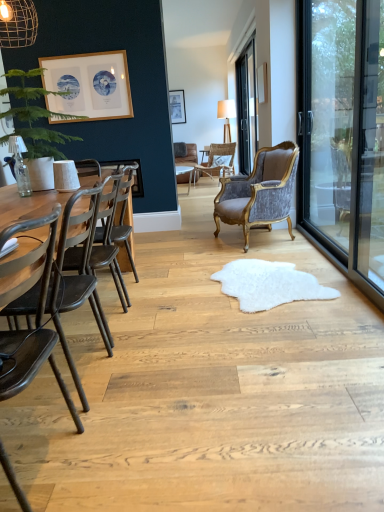
The height and width of the screenshot is (512, 384). I want to click on dark brown wood chair at left, which ranks as the 3th chair in back-to-front order, so click(108, 244).

Describe the element at coordinates (34, 117) in the screenshot. I see `green matte plant at left` at that location.

In order to face green matte plant at left, should I rotate leftwards or rightwards?

To align with it, rotate left about 20.318°.

Locate an element on the screen. The width and height of the screenshot is (384, 512). wooden picture frame at upper right, which is the first picture frame from right to left is located at coordinates (262, 83).

This screenshot has width=384, height=512. What do you see at coordinates (89, 85) in the screenshot?
I see `wooden framed artwork at upper left, which ranks as the third picture frame in right-to-left order` at bounding box center [89, 85].

This screenshot has height=512, width=384. What are the coordinates of `dark brown wood chair at left, the second chair positioned from the front` in the screenshot? It's located at (108, 244).

Considering the sizes of objects velvet grey armchair at center, which is counted as the 2th chair, starting from the back, and dark brown wood chair at left, the fourth chair viewed from the back, in the image provided, who is thinner, velvet grey armchair at center, which is counted as the 2th chair, starting from the back, or dark brown wood chair at left, the fourth chair viewed from the back,?

dark brown wood chair at left, the fourth chair viewed from the back.

Which is behind, velvet grey armchair at center, the 3th chair when ordered from front to back, or dark brown wood chair at left, which is the 1th chair in front-to-back order?

Positioned behind is velvet grey armchair at center, the 3th chair when ordered from front to back.

Consider the image. Can you confirm if velvet grey armchair at center, the 3th chair when ordered from front to back, is positioned to the right of dark brown wood chair at left, which is the 1th chair in front-to-back order?

Correct, you'll find velvet grey armchair at center, the 3th chair when ordered from front to back, to the right of dark brown wood chair at left, which is the 1th chair in front-to-back order.

Considering the relative sizes of velvet grey armchair at center, the 3th chair when ordered from front to back, and dark brown wood chair at left, the fourth chair viewed from the back, in the image provided, is velvet grey armchair at center, the 3th chair when ordered from front to back, shorter than dark brown wood chair at left, the fourth chair viewed from the back,?

In fact, velvet grey armchair at center, the 3th chair when ordered from front to back, may be taller than dark brown wood chair at left, the fourth chair viewed from the back.

How many degrees apart are the facing directions of wooden picture frame at upper right, acting as the 2th picture frame starting from the front, and dark brown leather swivel chair at left?

2.17 degrees.

Consider the image. Could dark brown leather swivel chair at left be considered to be inside wooden picture frame at upper right, which ranks as the 3th picture frame in left-to-right order?

No.

From the image's perspective, which one is positioned lower, wooden picture frame at upper right, which is the first picture frame from right to left, or dark brown leather swivel chair at left?

dark brown leather swivel chair at left, from the image's perspective.

Considering the positions of objects wooden picture frame at upper right, acting as the 2th picture frame starting from the front, and dark brown leather swivel chair at left in the image provided, who is more to the right, wooden picture frame at upper right, acting as the 2th picture frame starting from the front, or dark brown leather swivel chair at left?

wooden picture frame at upper right, acting as the 2th picture frame starting from the front.

At what (x,y) coordinates should I click in order to perform the action: click on screen door to the right of wooden textured lamp at center, the first lamp when ordered from top to bottom. Please return your answer as a coordinate pair (x, y). Looking at the image, I should click on (343, 134).

Is transparent glass screen door at right oriented towards wooden textured lamp at center, which is the second lamp in bottom-to-top order?

No, transparent glass screen door at right is not facing towards wooden textured lamp at center, which is the second lamp in bottom-to-top order.

Is transparent glass screen door at right closer to the viewer compared to wooden textured lamp at center, which is the second lamp in bottom-to-top order?

Yes.

Is white glossy round table at center behind wooden framed artwork at upper left, the third picture frame from the back?

Yes, the depth of white glossy round table at center is greater than that of wooden framed artwork at upper left, the third picture frame from the back.

Looking at their sizes, would you say white glossy round table at center is wider or thinner than wooden framed artwork at upper left, the third picture frame from the back?

Considering their sizes, white glossy round table at center looks broader than wooden framed artwork at upper left, the third picture frame from the back.

Who is smaller, white glossy round table at center or wooden framed artwork at upper left, the 1th picture frame from the front?

wooden framed artwork at upper left, the 1th picture frame from the front.

Is wooden framed artwork at upper left, the 1th picture frame from the front, surrounding matte wooden picture frame at center, the 1th picture frame in the top-to-bottom sequence?

No, matte wooden picture frame at center, the 1th picture frame in the top-to-bottom sequence, is not surrounded by wooden framed artwork at upper left, the 1th picture frame from the front.

Does wooden framed artwork at upper left, the third picture frame from the back, come behind matte wooden picture frame at center, the 1th picture frame in the top-to-bottom sequence?

No, wooden framed artwork at upper left, the third picture frame from the back, is closer to the viewer.

Measure the distance from wooden framed artwork at upper left, the third picture frame from the back, to matte wooden picture frame at center, the third picture frame ordered from the bottom.

14.44 feet.

How many degrees apart are the facing directions of wooden framed artwork at upper left, which ranks as the third picture frame in right-to-left order, and matte wooden picture frame at center, marked as the third picture frame in a front-to-back arrangement?

The facing directions of wooden framed artwork at upper left, which ranks as the third picture frame in right-to-left order, and matte wooden picture frame at center, marked as the third picture frame in a front-to-back arrangement, are 0.676 degrees apart.

Does transparent glass door at center right have a greater height compared to wooden framed artwork at upper left, the 1th picture frame from the left?

Yes, transparent glass door at center right is taller than wooden framed artwork at upper left, the 1th picture frame from the left.

From the image's perspective, is transparent glass door at center right over wooden framed artwork at upper left, which is the third picture frame in top-to-bottom order?

Correct, transparent glass door at center right appears higher than wooden framed artwork at upper left, which is the third picture frame in top-to-bottom order, in the image.

Is transparent glass door at center right turned away from wooden framed artwork at upper left, which ranks as the third picture frame in right-to-left order?

That's not correct — transparent glass door at center right is not looking away from wooden framed artwork at upper left, which ranks as the third picture frame in right-to-left order.

Which is more to the left, transparent glass door at center right or wooden framed artwork at upper left, the 1th picture frame from the front?

wooden framed artwork at upper left, the 1th picture frame from the front.

Is clear glass bottle at left, placed as the 2th lamp when sorted from right to left, inside wooden textured lamp at center, positioned as the 2th lamp in left-to-right order?

No, clear glass bottle at left, placed as the 2th lamp when sorted from right to left, is located outside of wooden textured lamp at center, positioned as the 2th lamp in left-to-right order.

Considering the relative positions of wooden textured lamp at center, the first lamp positioned from the back, and clear glass bottle at left, positioned as the 2th lamp in back-to-front order, in the image provided, is wooden textured lamp at center, the first lamp positioned from the back, to the left or to the right of clear glass bottle at left, positioned as the 2th lamp in back-to-front order,?

wooden textured lamp at center, the first lamp positioned from the back, is to the right of clear glass bottle at left, positioned as the 2th lamp in back-to-front order.

Considering the relative sizes of wooden textured lamp at center, the first lamp when ordered from top to bottom, and clear glass bottle at left, which ranks as the first lamp in front-to-back order, in the image provided, is wooden textured lamp at center, the first lamp when ordered from top to bottom, smaller than clear glass bottle at left, which ranks as the first lamp in front-to-back order,?

Incorrect, wooden textured lamp at center, the first lamp when ordered from top to bottom, is not smaller in size than clear glass bottle at left, which ranks as the first lamp in front-to-back order.

How much distance is there between wooden textured lamp at center, the first lamp when ordered from top to bottom, and clear glass bottle at left, acting as the first lamp starting from the bottom?

A distance of 5.84 meters exists between wooden textured lamp at center, the first lamp when ordered from top to bottom, and clear glass bottle at left, acting as the first lamp starting from the bottom.

Find the location of a particular element. the 2nd chair positioned above the dark brown wood chair at left, the fourth chair viewed from the back (from the image's perspective) is located at coordinates (259, 192).

I want to click on swivel chair below the wooden picture frame at upper right, the second picture frame positioned from the back (from a real-world perspective), so click(75, 281).

From the image, which object appears to be nearer to wooden picture frame at upper right, the second picture frame positioned from the back, velvet grey armchair at center, the 3th chair when ordered from front to back, or dark brown wood chair at left, which ranks as the 3th chair in back-to-front order?

velvet grey armchair at center, the 3th chair when ordered from front to back.

Considering their positions, is wooden textured lamp at center, the first lamp positioned from the back, positioned further to wooden picture frame at upper right, the second picture frame positioned from the back, than clear glass bottle at left, acting as the second lamp starting from the top?

Based on the image, wooden textured lamp at center, the first lamp positioned from the back, appears to be further to wooden picture frame at upper right, the second picture frame positioned from the back.

Based on their spatial positions, is velvet grey armchair at center, the 3th chair when ordered from front to back, or wooden picture frame at upper right, which ranks as the 3th picture frame in left-to-right order, closer to transparent glass door at center right?

The object closer to transparent glass door at center right is wooden picture frame at upper right, which ranks as the 3th picture frame in left-to-right order.

From the image, which object appears to be nearer to dark brown wood chair at left, the second chair positioned from the front, transparent glass door at center right or wooden textured lamp at center, which is the first lamp from right to left?

transparent glass door at center right.

When comparing their distances from white fluffy rug at center, does transparent glass screen door at right or matte wooden picture frame at center, marked as the third picture frame in a front-to-back arrangement, seem closer?

Based on the image, transparent glass screen door at right appears to be nearer to white fluffy rug at center.

Looking at the image, which one is located further to matte wooden picture frame at center, the second picture frame viewed from the left, dark brown leather swivel chair at left or leather cushioned chair at center, marked as the 4th chair in a front-to-back arrangement?

Among the two, dark brown leather swivel chair at left is located further to matte wooden picture frame at center, the second picture frame viewed from the left.

Estimate the real-world distances between objects in this image. Which object is closer to white fluffy rug at center, leather cushioned chair at center, the 1th chair when ordered from back to front, or matte wooden picture frame at center, the second picture frame from the right?

leather cushioned chair at center, the 1th chair when ordered from back to front, is closer to white fluffy rug at center.

Looking at the image, which one is located closer to dark brown wood chair at left, the fourth chair viewed from the back, transparent glass screen door at right or wooden textured lamp at center, the first lamp when ordered from top to bottom?

transparent glass screen door at right is closer to dark brown wood chair at left, the fourth chair viewed from the back.

You are a GUI agent. You are given a task and a screenshot of the screen. Output one action in this format:
    pyautogui.click(x=<x>, y=<y>)
    Task: Click on the screen door between dark brown leather swivel chair at left and transparent glass door at center right along the z-axis
    The image size is (384, 512).
    Given the screenshot: What is the action you would take?
    pyautogui.click(x=343, y=134)

Where is `screen door positioned between dark brown wood chair at left, which is the 1th chair in front-to-back order, and wooden textured lamp at center, the first lamp positioned from the back, from near to far`? This screenshot has width=384, height=512. screen door positioned between dark brown wood chair at left, which is the 1th chair in front-to-back order, and wooden textured lamp at center, the first lamp positioned from the back, from near to far is located at coordinates (343, 134).

In order to click on mat between dark brown wood chair at left, the second chair positioned from the front, and wooden textured lamp at center, the first lamp when ordered from top to bottom, in the front-back direction in this screenshot , I will do `click(269, 284)`.

Find the location of `mat between clear glass bottle at left, positioned as the 2th lamp in back-to-front order, and wooden textured lamp at center, which is the second lamp in bottom-to-top order, in the front-back direction`. mat between clear glass bottle at left, positioned as the 2th lamp in back-to-front order, and wooden textured lamp at center, which is the second lamp in bottom-to-top order, in the front-back direction is located at coordinates (269, 284).